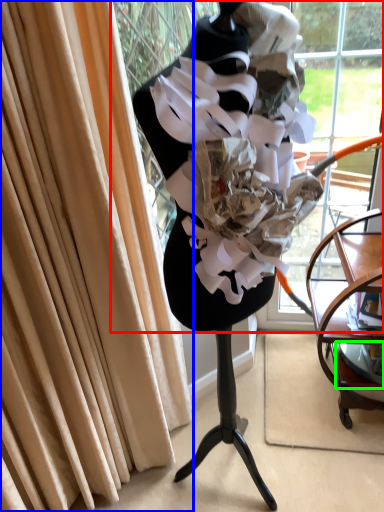
Question: Based on their relative distances, which object is farther from shop window (highlighted by a red box)? Choose from curtain (highlighted by a blue box) and shelf (highlighted by a green box).

Choices:
 (A) curtain
 (B) shelf

Answer: (B)